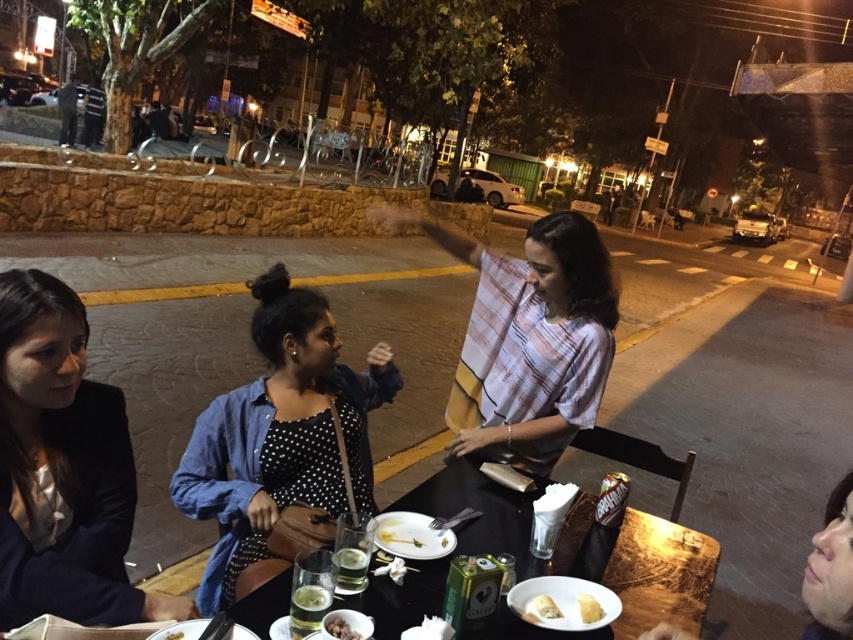
Which is above, translucent glass at table center or smooth brown bread at center?

translucent glass at table center

Does point (306, 605) come farther from viewer compared to point (329, 621)?

Yes, point (306, 605) is behind point (329, 621).

Where is `translucent glass at table center`? translucent glass at table center is located at coordinates (310, 596).

Consider the image. Is white matte plate at center wider than translucent glass cup at table center?

Yes.

Is point (442, 538) more distant than point (347, 556)?

Yes, point (442, 538) is behind point (347, 556).

Identify the location of white matte plate at center. (410, 536).

Locate an element on the screen. Image resolution: width=853 pixels, height=640 pixels. white matte plate at center is located at coordinates [x=410, y=536].

Is plaid cotton shirt at center below translucent glass at table center?

No, plaid cotton shirt at center is not below translucent glass at table center.

Is plaid cotton shirt at center wider than translucent glass at table center?

Yes, plaid cotton shirt at center is wider than translucent glass at table center.

Who is more distant from viewer, (500, 364) or (320, 598)?

The point (500, 364) is behind.

Locate an element on the screen. The height and width of the screenshot is (640, 853). plaid cotton shirt at center is located at coordinates click(x=527, y=339).